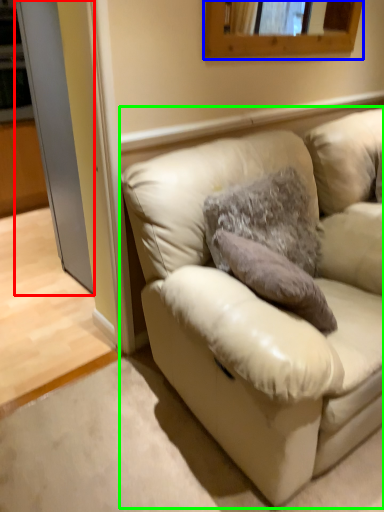
Question: Based on their relative distances, which object is farther from glass door (highlighted by a red box)? Choose from mirror (highlighted by a blue box) and studio couch (highlighted by a green box).

Choices:
 (A) mirror
 (B) studio couch

Answer: (B)